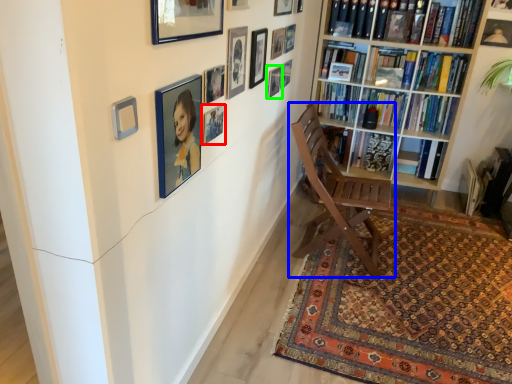
Question: Based on their relative distances, which object is nearer to picture frame (highlighted by a red box)? Choose from chair (highlighted by a blue box) and picture frame (highlighted by a green box).

Choices:
 (A) chair
 (B) picture frame

Answer: (B)